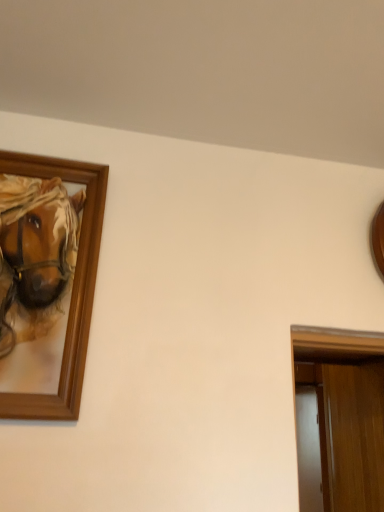
Where is `matte wooden horse portrait at upper left`? matte wooden horse portrait at upper left is located at coordinates (35, 255).

Describe the element at coordinates (35, 255) in the screenshot. Image resolution: width=384 pixels, height=512 pixels. I see `matte wooden horse portrait at upper left` at that location.

From the picture: What is the approximate height of matte wooden horse portrait at upper left?

64.76 centimeters.

Locate an element on the screen. matte wooden horse portrait at upper left is located at coordinates (35, 255).